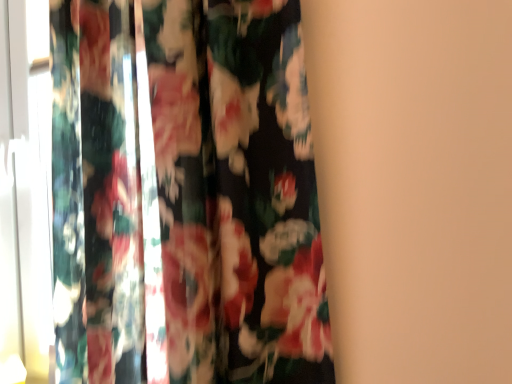
This screenshot has width=512, height=384. What are the coordinates of `floral fabric at left` in the screenshot? It's located at (234, 195).

In order to face floral fabric at left, should I rotate leftwards or rightwards?

Rotate your view left by about 22.486°.

Describe the element at coordinates (234, 195) in the screenshot. I see `floral fabric at left` at that location.

At what (x,y) coordinates should I click in order to perform the action: click on floral fabric at left. Please return your answer as a coordinate pair (x, y). Looking at the image, I should click on (234, 195).